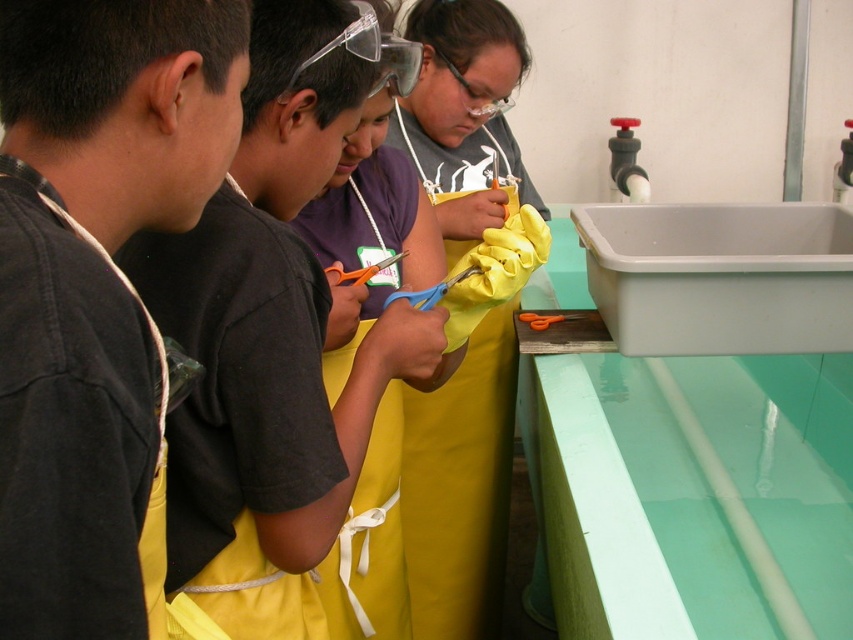
Looking at this image, between yellow fabric apron at center and orange plastic scissors at center, which one is positioned higher?

orange plastic scissors at center is above.

Can you confirm if yellow fabric apron at center is thinner than orange plastic scissors at center?

Incorrect, yellow fabric apron at center's width is not less than orange plastic scissors at center's.

Is point (372, 348) closer to camera compared to point (392, 262)?

Yes, it is.

Locate an element on the screen. This screenshot has height=640, width=853. yellow fabric apron at center is located at coordinates (271, 339).

Who is more distant from viewer, (508,92) or (422,300)?

Positioned behind is point (508,92).

Consider the image. Is yellow rubber gloves at center to the right of blue plastic scissors at center from the viewer's perspective?

Correct, you'll find yellow rubber gloves at center to the right of blue plastic scissors at center.

In order to click on yellow rubber gloves at center in this screenshot , I will do `click(461, 486)`.

You are a GUI agent. You are given a task and a screenshot of the screen. Output one action in this format:
    pyautogui.click(x=<x>, y=<y>)
    Task: Click on the yellow fabric apron at center
    The image size is (853, 640).
    Given the screenshot: What is the action you would take?
    pyautogui.click(x=271, y=339)

Is point (196, 550) in front of point (492, 506)?

Yes, point (196, 550) is in front of point (492, 506).

Identify the location of yellow fabric apron at center. (271, 339).